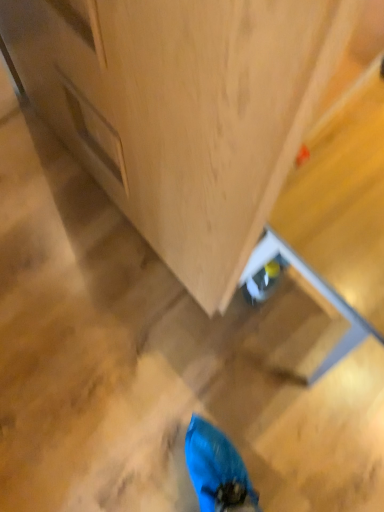
Locate an element on the screen. Image resolution: width=384 pixels, height=512 pixels. vacant space in wooden cabinet at lower center (from a real-world perspective) is located at coordinates (118, 214).